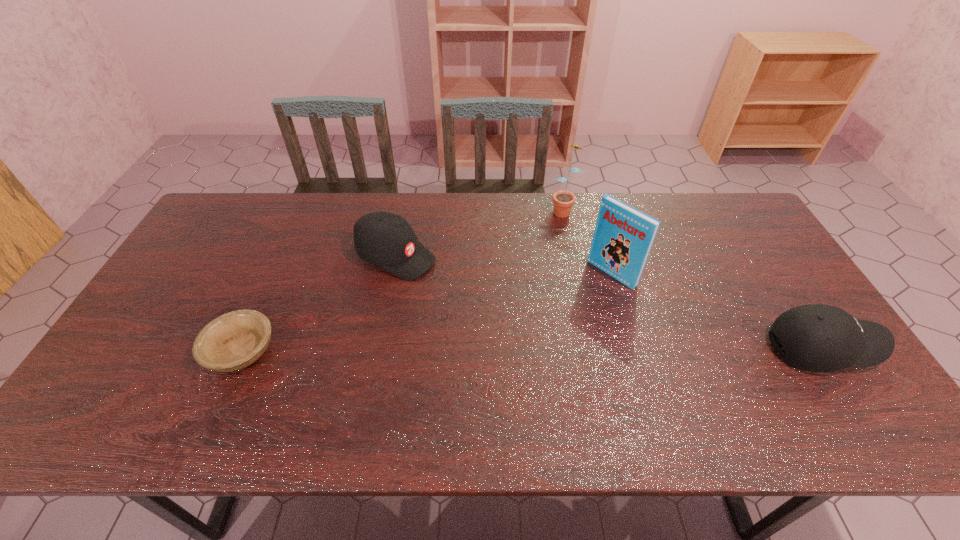
Locate an element on the screen. This screenshot has height=540, width=960. free spot on the desktop that is between the bowl and the rightmost object and is positioned with a logo on the front of the fourth object from right to left is located at coordinates (598, 349).

You are a GUI agent. You are given a task and a screenshot of the screen. Output one action in this format:
    pyautogui.click(x=<x>, y=<y>)
    Task: Click on the free space on the desktop that is between the shortest object and the rightmost object and is positioned on the front cover of the book
    This screenshot has height=540, width=960.
    Given the screenshot: What is the action you would take?
    pyautogui.click(x=519, y=350)

Identify the location of free space on the desktop that is between the leftmost object and the right baseball cap and is positioned on the flower of the farthest object. (492, 350).